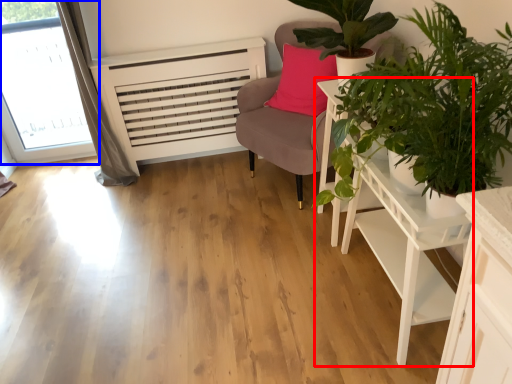
Question: Which of the following is the farthest to the observer, table (highlighted by a red box) or window (highlighted by a blue box)?

Choices:
 (A) table
 (B) window

Answer: (B)